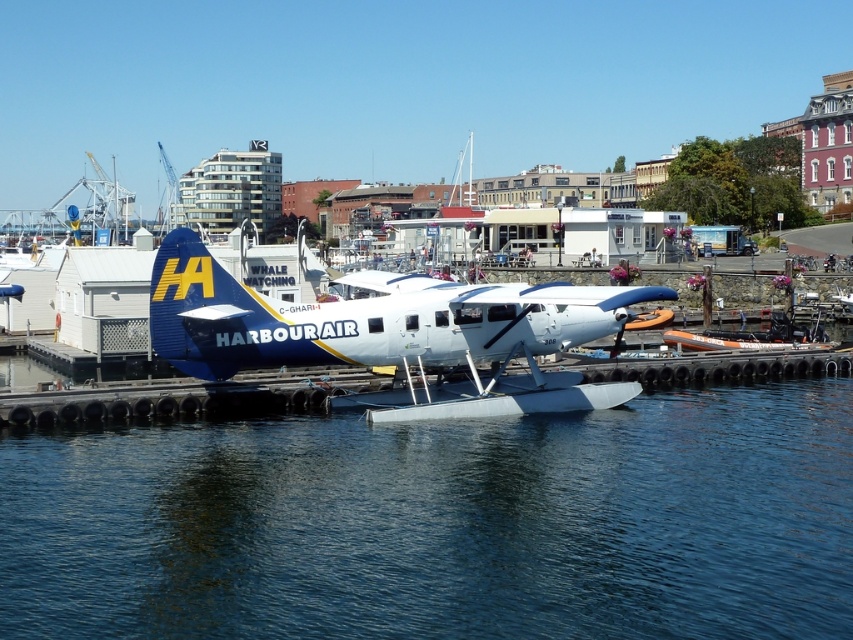
You are a pilot preparing to take off from the blue matte seaplane at center. You notice the blue water at center in front of you. Can the seaplane fit within the width of the water area ahead?

The blue water at center is wider than the blue matte seaplane at center, so the seaplane can fit within the width of the water area ahead.

You are a pilot preparing to board the blue matte seaplane at center. As you look down from the dock, where do you see the blue water at center in relation to the seaplane?

The blue water at center is located below the blue matte seaplane at center, so you would see the blue water at center underneath the seaplane as you look down from the dock.

You are a pilot preparing to take off from the marina. You notice the blue water at center and the blue matte seaplane at center. Which one is lower in height?

The blue water at center has a lesser height compared to the blue matte seaplane at center, so the blue water at center is lower in height.